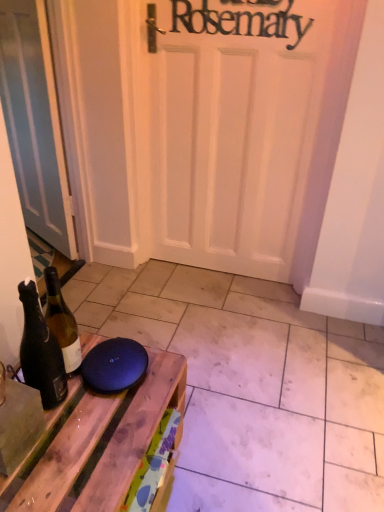
I want to click on unoccupied region to the right of dark brown glass bottle at left, so click(x=114, y=406).